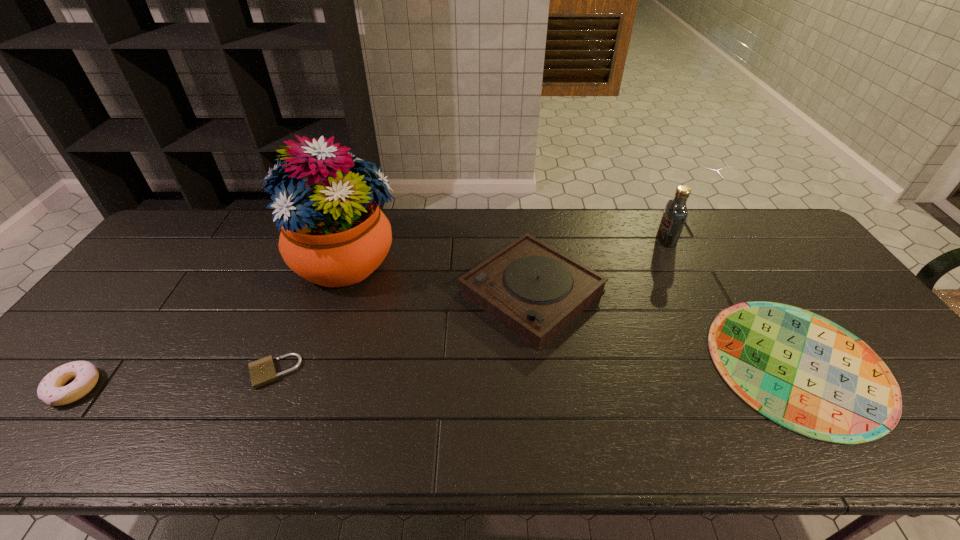
Locate an element on the screen. The image size is (960, 540). vacant area between the vodka and the second shortest object is located at coordinates (470, 306).

This screenshot has height=540, width=960. What are the coordinates of `free space between the gameboard and the vodka` in the screenshot? It's located at (732, 302).

Locate an element on the screen. This screenshot has width=960, height=540. free space between the third object from right to left and the second shortest object is located at coordinates (402, 332).

Find the location of a particular element. The image size is (960, 540). free point between the flower arrangement and the third tallest object is located at coordinates [x=440, y=276].

Locate an element on the screen. free space between the third shortest object and the tallest object is located at coordinates (211, 325).

Identify the location of free space between the second shortest object and the third shortest object. (174, 380).

You are a GUI agent. You are given a task and a screenshot of the screen. Output one action in this format:
    pyautogui.click(x=<x>, y=<y>)
    Task: Click on the empty location between the vodka and the leftmost object
    
    Given the screenshot: What is the action you would take?
    pyautogui.click(x=370, y=314)

Identify the location of object that is the fourth closest to the padlock. (802, 371).

I want to click on object that is the third nearest to the second tallest object, so click(333, 233).

Identify the location of vacant space that satisfies the following two spatial constraints: 1. on the back side of the tallest object; 2. on the right side of the doughnut. The image size is (960, 540). (173, 261).